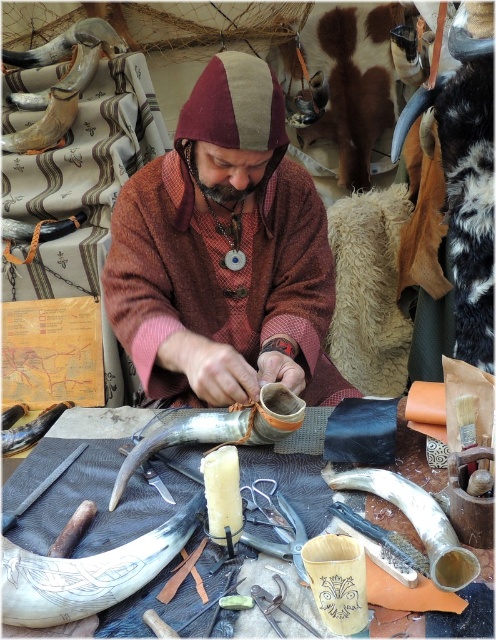
Is smooth horn at center above polished horn at lower left?

Indeed, smooth horn at center is positioned over polished horn at lower left.

Between smooth horn at center and polished horn at lower left, which one appears on the right side from the viewer's perspective?

From the viewer's perspective, smooth horn at center appears more on the right side.

Which is behind, point (271, 428) or point (37, 432)?

Positioned behind is point (37, 432).

In order to click on smooth horn at center in this screenshot , I will do `click(219, 429)`.

Between point (469, 556) and point (278, 589), which one is positioned behind?

Point (278, 589)

Who is taller, shiny silver horn at lower right or metallic wire at lower center?

shiny silver horn at lower right

Locate an element on the screen. shiny silver horn at lower right is located at coordinates (416, 522).

Is the position of matte brown leather boot at center less distant than that of metallic wire at lower center?

That is False.

I want to click on matte brown leather boot at center, so click(225, 253).

Find the location of a particular element. matte brown leather boot at center is located at coordinates (225, 253).